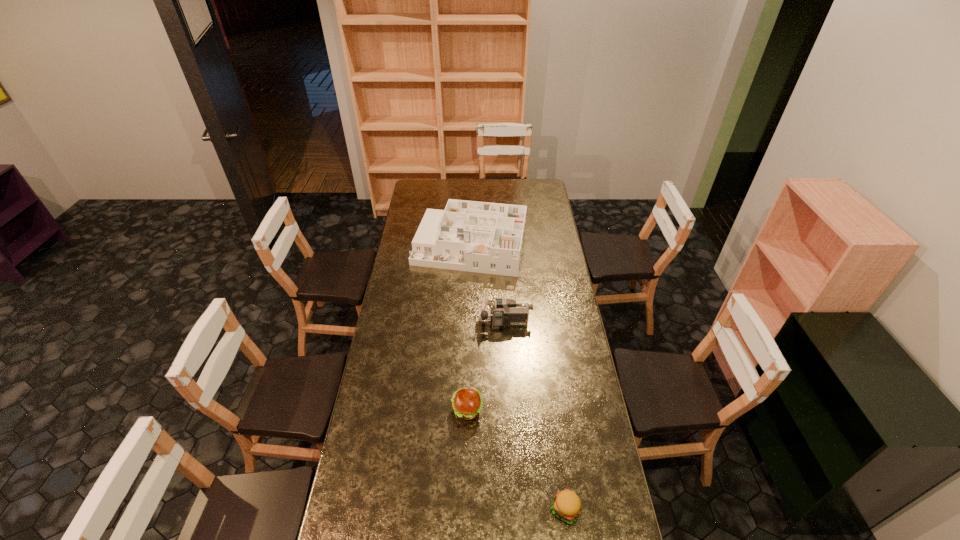
Locate an element on the screen. The image size is (960, 540). free space between the second farthest object and the shortest object is located at coordinates (535, 416).

I want to click on free spot between the left hamburger and the farthest object, so click(x=468, y=328).

This screenshot has width=960, height=540. In order to click on free spot between the left hamburger and the shortest object in this screenshot , I will do `click(516, 460)`.

Locate an element on the screen. The width and height of the screenshot is (960, 540). free space between the farther hamburger and the dollhouse is located at coordinates (468, 328).

Find the location of `free spot between the third farthest object and the camcorder`. free spot between the third farthest object and the camcorder is located at coordinates (486, 366).

Find the location of a particular element. vacant space that is in between the second nearest object and the farthest object is located at coordinates (468, 328).

Image resolution: width=960 pixels, height=540 pixels. What are the coordinates of `vacant area that lies between the dollhouse and the shorter hamburger` in the screenshot? It's located at (517, 378).

The height and width of the screenshot is (540, 960). What are the coordinates of `unoccupied area between the right hamburger and the farther hamburger` in the screenshot? It's located at (516, 460).

Locate an element on the screen. The width and height of the screenshot is (960, 540). object that is the closest one to the farther hamburger is located at coordinates (566, 505).

Locate an element on the screen. The image size is (960, 540). the closest object to the second shortest object is located at coordinates (566, 505).